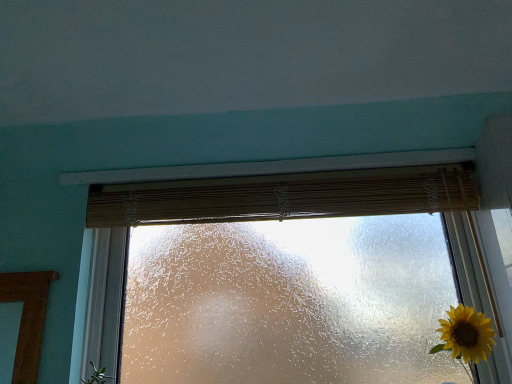
Identify the location of bamboo curtain at center. (286, 196).

This screenshot has height=384, width=512. What do you see at coordinates (285, 191) in the screenshot?
I see `frosted glass window at center` at bounding box center [285, 191].

Find the location of a particular element. This screenshot has height=384, width=512. frosted glass window at center is located at coordinates (285, 191).

Locate an element on the screen. The width and height of the screenshot is (512, 384). teal matte wall at upper center is located at coordinates (242, 54).

The width and height of the screenshot is (512, 384). I want to click on bamboo curtain at center, so click(286, 196).

Is frosted glass window at center positioned far away from teal matte wall at upper center?

No, frosted glass window at center is in close proximity to teal matte wall at upper center.

From the image's perspective, is frosted glass window at center located beneath teal matte wall at upper center?

Yes.

At what (x,y) coordinates should I click in order to perform the action: click on backdrop above the frosted glass window at center (from a real-world perspective). Please return your answer as a coordinate pair (x, y). This screenshot has width=512, height=384. Looking at the image, I should click on point(242,54).

Between bamboo curtain at center and frosted glass window at center, which one appears on the left side from the viewer's perspective?

From the viewer's perspective, bamboo curtain at center appears more on the left side.

Does point (227, 206) lie behind point (268, 170)?

No, it is in front of (268, 170).

In the scene shown: Between bamboo curtain at center and frosted glass window at center, which one has larger size?

frosted glass window at center.

From the image's perspective, is bamboo curtain at center over frosted glass window at center?

Yes, from the image's perspective, bamboo curtain at center is over frosted glass window at center.

Are bamboo curtain at center and teal matte wall at upper center making contact?

No, bamboo curtain at center is not beside teal matte wall at upper center.

Based on the photo, between bamboo curtain at center and teal matte wall at upper center, which one has smaller width?

Thinner between the two is bamboo curtain at center.

Is bamboo curtain at center positioned before teal matte wall at upper center?

That is False.

This screenshot has width=512, height=384. I want to click on backdrop in front of the bamboo curtain at center, so click(242, 54).

How much distance is there between teal matte wall at upper center and bamboo curtain at center?

teal matte wall at upper center is 14.45 inches away from bamboo curtain at center.

Based on the photo, which object is closer to the camera taking this photo, teal matte wall at upper center or bamboo curtain at center?

teal matte wall at upper center is closer to the camera.

Between teal matte wall at upper center and bamboo curtain at center, which one has more height?

With more height is bamboo curtain at center.

In the scene shown: From the image's perspective, which is below, teal matte wall at upper center or bamboo curtain at center?

bamboo curtain at center appears lower in the image.

Which is behind, point (11, 116) or point (415, 197)?

The point (415, 197) is farther from the camera.

Which of these two, teal matte wall at upper center or frosted glass window at center, is wider?

With larger width is teal matte wall at upper center.

What's the angular difference between teal matte wall at upper center and frosted glass window at center's facing directions?

The angle between the facing direction of teal matte wall at upper center and the facing direction of frosted glass window at center is 89.4 degrees.

Identify the location of curtain behind the frosted glass window at center. (286, 196).

Is frosted glass window at center thinner than bamboo curtain at center?

No.

Is frosted glass window at center taller or shorter than bamboo curtain at center?

In the image, frosted glass window at center appears to be taller than bamboo curtain at center.

This screenshot has width=512, height=384. Identify the location of window that is below the teal matte wall at upper center (from the image's perspective). (285, 191).

Identify the location of curtain on the left of frosted glass window at center. This screenshot has width=512, height=384. (286, 196).

When comparing their distances from teal matte wall at upper center, does frosted glass window at center or bamboo curtain at center seem closer?

frosted glass window at center is positioned closer to the anchor teal matte wall at upper center.

From the picture: Looking at the image, which one is located closer to teal matte wall at upper center, bamboo curtain at center or frosted glass window at center?

frosted glass window at center lies closer to teal matte wall at upper center than the other object.

Estimate the real-world distances between objects in this image. Which object is closer to bamboo curtain at center, frosted glass window at center or teal matte wall at upper center?

frosted glass window at center.

Based on their spatial positions, is teal matte wall at upper center or frosted glass window at center further from bamboo curtain at center?

teal matte wall at upper center.

Looking at the image, which one is located closer to frosted glass window at center, teal matte wall at upper center or bamboo curtain at center?

bamboo curtain at center lies closer to frosted glass window at center than the other object.

Considering their positions, is bamboo curtain at center positioned closer to frosted glass window at center than teal matte wall at upper center?

bamboo curtain at center lies closer to frosted glass window at center than the other object.

The width and height of the screenshot is (512, 384). I want to click on curtain between teal matte wall at upper center and frosted glass window at center in the vertical direction, so click(x=286, y=196).